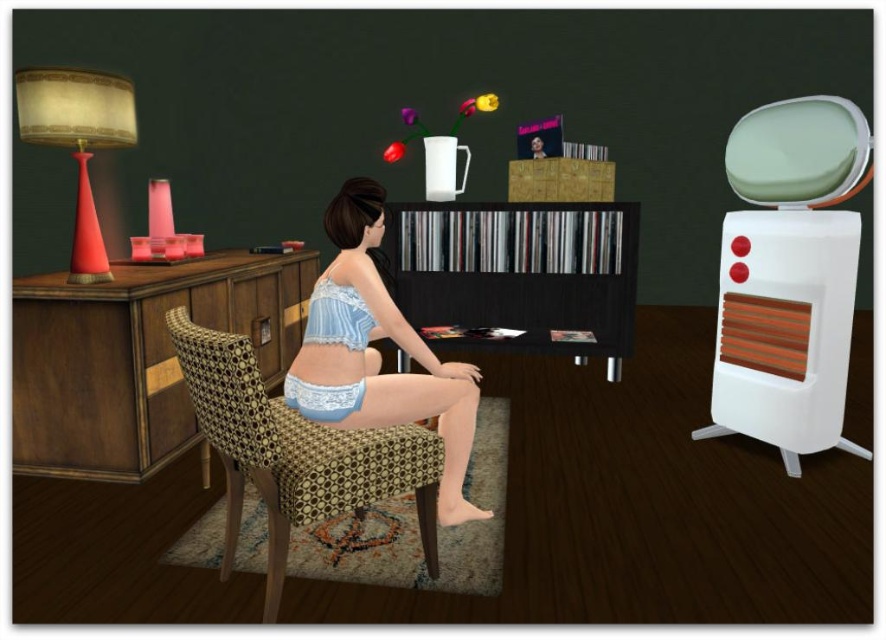
Question: Is the position of black wood bookshelf at center less distant than that of matte red lampshade at left?

Choices:
 (A) yes
 (B) no

Answer: (B)

Question: Which point is farther to the camera?

Choices:
 (A) matte red lampshade at left
 (B) lace-patterned fabric armchair at center
 (C) lacy white underwear at center
 (D) black wood bookshelf at center

Answer: (D)

Question: Which point is closer to the camera taking this photo?

Choices:
 (A) (12, 348)
 (B) (68, 83)
 (C) (236, 422)
 (D) (328, 412)

Answer: (C)

Question: Where is black wood bookshelf at center located in relation to lace-patterned fabric armchair at center in the image?

Choices:
 (A) left
 (B) right

Answer: (B)

Question: Where is lace-patterned fabric armchair at center located in relation to lacy white underwear at center in the image?

Choices:
 (A) above
 (B) below

Answer: (B)

Question: Which of the following is the farthest from the observer?

Choices:
 (A) (554, 253)
 (B) (324, 432)
 (C) (138, 352)
 (D) (330, 419)

Answer: (A)